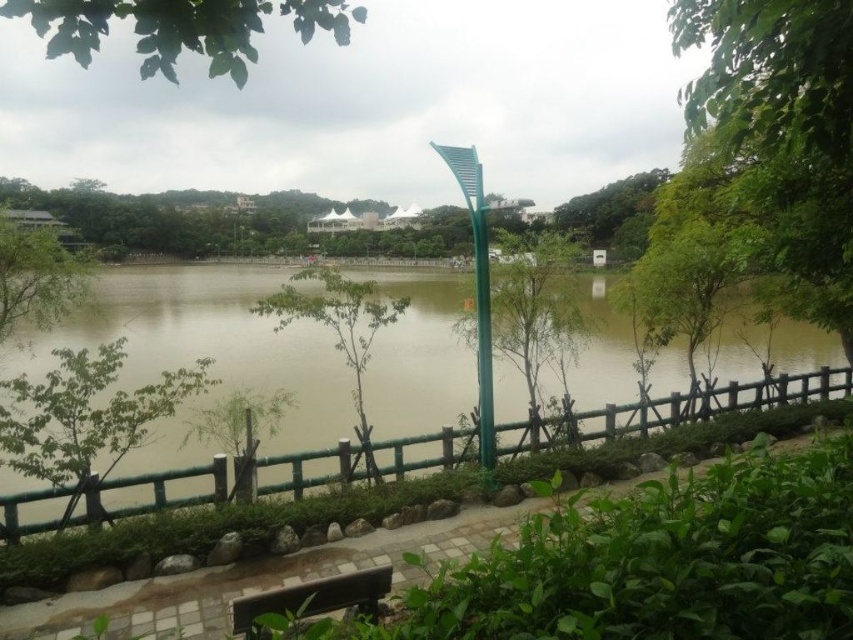
Does green matte tree at center have a smaller size compared to brown wooden bench at lower center?

No.

Which of these two, green matte tree at center or brown wooden bench at lower center, stands shorter?

Standing shorter between the two is brown wooden bench at lower center.

Locate an element on the screen. Image resolution: width=853 pixels, height=640 pixels. green matte tree at center is located at coordinates (535, 307).

Is green leafy tree at upper right shorter than brown wooden bench at lower center?

No, green leafy tree at upper right is not shorter than brown wooden bench at lower center.

Is green leafy tree at upper right further to the viewer compared to brown wooden bench at lower center?

No, green leafy tree at upper right is in front of brown wooden bench at lower center.

Does point (722, 32) come behind point (279, 598)?

Yes, point (722, 32) is behind point (279, 598).

Where is `green leafy tree at upper right`? green leafy tree at upper right is located at coordinates (782, 136).

Does green leafy tree at lower left have a greater height compared to green leafy tree at left?

Incorrect, green leafy tree at lower left's height is not larger of green leafy tree at left's.

This screenshot has height=640, width=853. What do you see at coordinates (85, 417) in the screenshot?
I see `green leafy tree at lower left` at bounding box center [85, 417].

Identify the location of green leafy tree at lower left. This screenshot has height=640, width=853. (85, 417).

You are a GUI agent. You are given a task and a screenshot of the screen. Output one action in this format:
    pyautogui.click(x=<x>, y=<y>)
    Task: Click on the green leafy tree at lower left
    
    Given the screenshot: What is the action you would take?
    pyautogui.click(x=85, y=417)